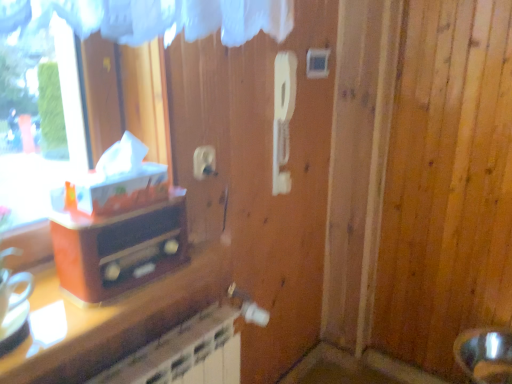
Question: From the image's perspective, does white plastic light switch at upper center appear lower than white plastic electric outlet at upper center?

Choices:
 (A) yes
 (B) no

Answer: (B)

Question: Does white plastic light switch at upper center have a greater width compared to white plastic electric outlet at upper center?

Choices:
 (A) yes
 (B) no

Answer: (A)

Question: Considering the relative sizes of white plastic light switch at upper center and white plastic electric outlet at upper center in the image provided, is white plastic light switch at upper center bigger than white plastic electric outlet at upper center?

Choices:
 (A) no
 (B) yes

Answer: (B)

Question: From a real-world perspective, is white plastic light switch at upper center under white plastic electric outlet at upper center?

Choices:
 (A) yes
 (B) no

Answer: (B)

Question: Is white plastic light switch at upper center turned away from white plastic electric outlet at upper center?

Choices:
 (A) no
 (B) yes

Answer: (A)

Question: Is point coord(317,67) positioned closer to the camera than point coord(170,251)?

Choices:
 (A) farther
 (B) closer

Answer: (A)

Question: From a real-world perspective, is white plastic light switch at upper center physically located above or below matte orange radio at left?

Choices:
 (A) above
 (B) below

Answer: (A)

Question: In terms of width, does white plastic light switch at upper center look wider or thinner when compared to matte orange radio at left?

Choices:
 (A) thin
 (B) wide

Answer: (A)

Question: From the image's perspective, is white plastic light switch at upper center positioned above or below matte orange radio at left?

Choices:
 (A) above
 (B) below

Answer: (A)

Question: Considering their positions, is white plastic electric outlet at upper center located in front of or behind white plastic light switch at upper center?

Choices:
 (A) front
 (B) behind

Answer: (A)

Question: Is white plastic electric outlet at upper center wider or thinner than white plastic light switch at upper center?

Choices:
 (A) wide
 (B) thin

Answer: (B)

Question: Considering the relative positions of white plastic electric outlet at upper center and white plastic light switch at upper center in the image provided, is white plastic electric outlet at upper center to the left or to the right of white plastic light switch at upper center?

Choices:
 (A) left
 (B) right

Answer: (A)

Question: From their relative heights in the image, would you say white plastic electric outlet at upper center is taller or shorter than white plastic light switch at upper center?

Choices:
 (A) short
 (B) tall

Answer: (A)

Question: Would you say matte orange radio at left is to the left or to the right of white plastic light switch at upper center in the picture?

Choices:
 (A) left
 (B) right

Answer: (A)

Question: From a real-world perspective, is matte orange radio at left physically located above or below white plastic light switch at upper center?

Choices:
 (A) below
 (B) above

Answer: (A)